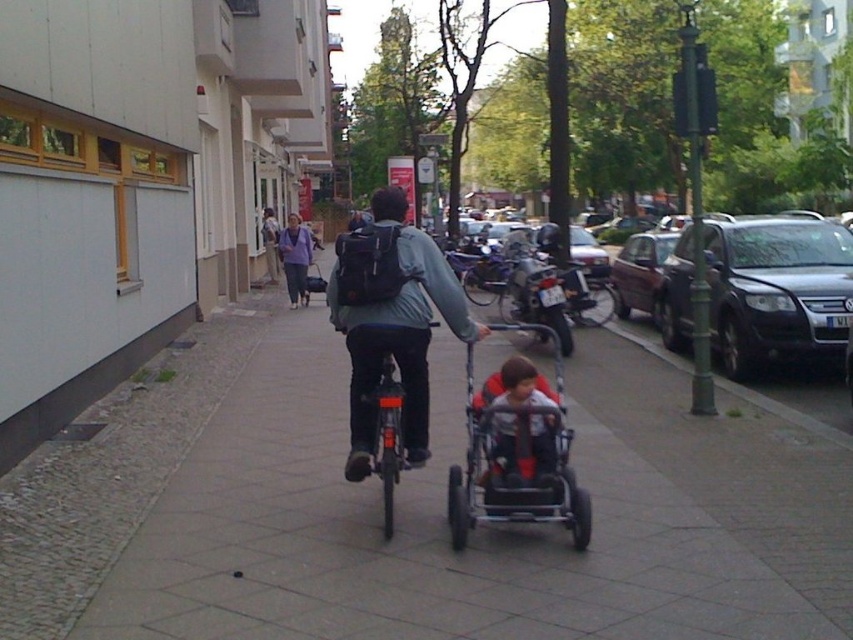
You are a delivery person who needs to place a package on the matte black backpack at center. However, there is a dark gray metallic suv at right blocking the path. Can you still access the backpack?

The dark gray metallic suv at right is positioned over the matte black backpack at center, so the suv is blocking access to the backpack. You cannot reach the matte black backpack at center without moving the suv.